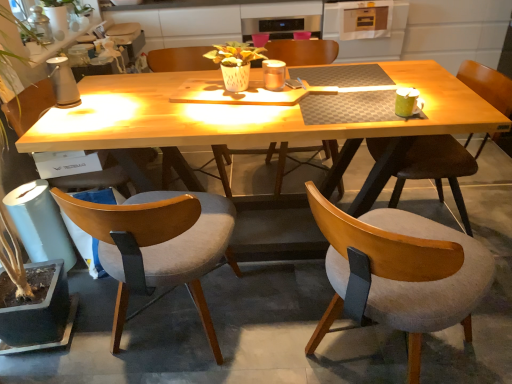
Question: Is metallic silver oven at upper center oriented towards green leafy plant at left?

Choices:
 (A) yes
 (B) no

Answer: (B)

Question: From a real-world perspective, is metallic silver oven at upper center under green leafy plant at left?

Choices:
 (A) no
 (B) yes

Answer: (B)

Question: Can you confirm if metallic silver oven at upper center is thinner than green leafy plant at left?

Choices:
 (A) no
 (B) yes

Answer: (A)

Question: Can you confirm if metallic silver oven at upper center is shorter than green leafy plant at left?

Choices:
 (A) no
 (B) yes

Answer: (B)

Question: Is metallic silver oven at upper center at the left side of green leafy plant at left?

Choices:
 (A) no
 (B) yes

Answer: (A)

Question: Considering the relative sizes of metallic silver oven at upper center and green leafy plant at left in the image provided, is metallic silver oven at upper center wider than green leafy plant at left?

Choices:
 (A) yes
 (B) no

Answer: (A)

Question: From the image's perspective, would you say green leafy plant at left is shown under light gray fabric chair at lower left, the 4th chair positioned from the right?

Choices:
 (A) no
 (B) yes

Answer: (A)

Question: From a real-world perspective, does green leafy plant at left stand above light gray fabric chair at lower left, which is the 2th chair in left-to-right order?

Choices:
 (A) yes
 (B) no

Answer: (A)

Question: Is the depth of green leafy plant at left less than that of light gray fabric chair at lower left, the 4th chair positioned from the right?

Choices:
 (A) no
 (B) yes

Answer: (B)

Question: Considering the relative sizes of green leafy plant at left and light gray fabric chair at lower left, the 4th chair positioned from the right, in the image provided, is green leafy plant at left taller than light gray fabric chair at lower left, the 4th chair positioned from the right,?

Choices:
 (A) no
 (B) yes

Answer: (B)

Question: Is green leafy plant at left not within light gray fabric chair at lower left, which is the 2th chair in left-to-right order?

Choices:
 (A) no
 (B) yes

Answer: (B)

Question: Is green leafy plant at left smaller than light gray fabric chair at lower left, which is the 2th chair in left-to-right order?

Choices:
 (A) no
 (B) yes

Answer: (A)

Question: Is light brown wood chair at lower left, arranged as the fifth chair when viewed from the right, wider than green leafy plant at left?

Choices:
 (A) yes
 (B) no

Answer: (B)